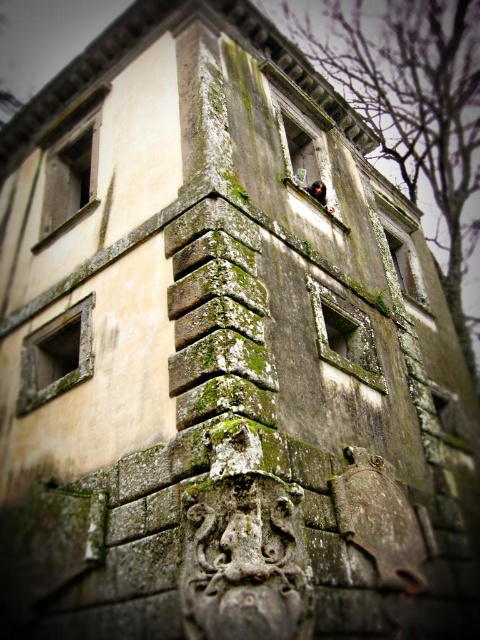
Is green mossy stone window at upper center taller than matte stone window at upper left?

Yes.

Which of these two, green mossy stone window at upper center or matte stone window at upper left, stands shorter?

Standing shorter between the two is matte stone window at upper left.

Is point (286, 160) positioned before point (73, 195)?

Yes, it is.

At what (x,y) coordinates should I click in order to perform the action: click on green mossy stone window at upper center. Please return your answer as a coordinate pair (x, y). The image size is (480, 640). Looking at the image, I should click on (302, 140).

Is point (82, 324) behind point (324, 360)?

That is True.

Can you confirm if green mossy stone window at lower left is shorter than green mossy stone window at center?

Yes, green mossy stone window at lower left is shorter than green mossy stone window at center.

Is point (90, 353) behind point (367, 365)?

No, it is not.

Where is `green mossy stone window at lower left`? The image size is (480, 640). green mossy stone window at lower left is located at coordinates (56, 356).

Between green mossy stone window at upper center and green mossy stone window at center, which one has more height?

With more height is green mossy stone window at upper center.

Based on the photo, can you confirm if green mossy stone window at upper center is wider than green mossy stone window at center?

Indeed, green mossy stone window at upper center has a greater width compared to green mossy stone window at center.

Which is in front, point (316, 116) or point (372, 336)?

Point (372, 336) is more forward.

Locate an element on the screen. The image size is (480, 640). green mossy stone window at upper center is located at coordinates (302, 140).